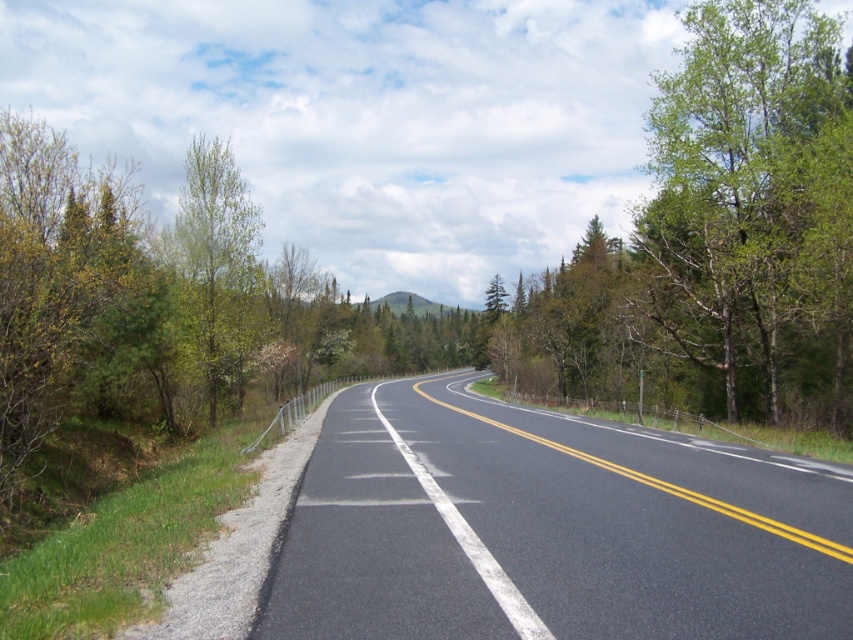
You are driving a car that is 2 meters wide. You need to pass through a narrow section of the road between the green leafy tree at right and the green leafy tree at left. Can your car fit through the gap between them?

The green leafy tree at right is wider than the green leafy tree at left. However, the question is about the gap between them, not their widths. The provided information does not specify the distance between the trees, only their relative widths. Therefore, it is impossible to determine if the car can fit through the gap based on the given data.

You are driving a car and need to park it on the black asphalt road at center. However, there is a green leafy tree at right nearby. Based on their sizes, can you park the car without hitting the tree?

The black asphalt road at center occupies less space than green leafy tree at right, so parking the car there might be risky as the tree takes up more area. Check the available space carefully before parking.